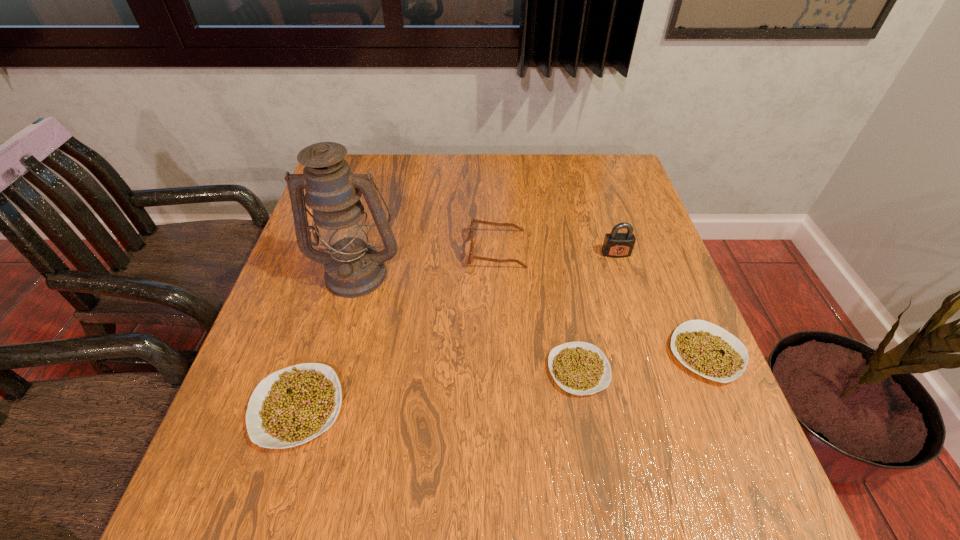
The image size is (960, 540). What are the coordinates of `oil lamp that is at the left edge` in the screenshot? It's located at (353, 268).

The height and width of the screenshot is (540, 960). I want to click on legume located at the right edge, so click(710, 351).

Where is `padlock at the right edge`? The image size is (960, 540). padlock at the right edge is located at coordinates (616, 245).

Find the location of a particular element. object positioned at the near left corner is located at coordinates tap(292, 406).

You are a GUI agent. You are given a task and a screenshot of the screen. Output one action in this format:
    pyautogui.click(x=<x>, y=<y>)
    Task: Click on the vacant space at the far edge
    
    Given the screenshot: What is the action you would take?
    pyautogui.click(x=508, y=164)

Where is `free space at the left edge`? This screenshot has width=960, height=540. free space at the left edge is located at coordinates (299, 255).

Locate an element on the screen. The height and width of the screenshot is (540, 960). vacant space at the right edge of the desktop is located at coordinates (647, 343).

This screenshot has width=960, height=540. I want to click on free space at the far right corner of the desktop, so click(584, 178).

Where is `vacant area at the near right corner`? vacant area at the near right corner is located at coordinates click(x=670, y=436).

The width and height of the screenshot is (960, 540). What are the coordinates of `vacant space in between the second legume from left to right and the oil lamp` in the screenshot? It's located at (468, 321).